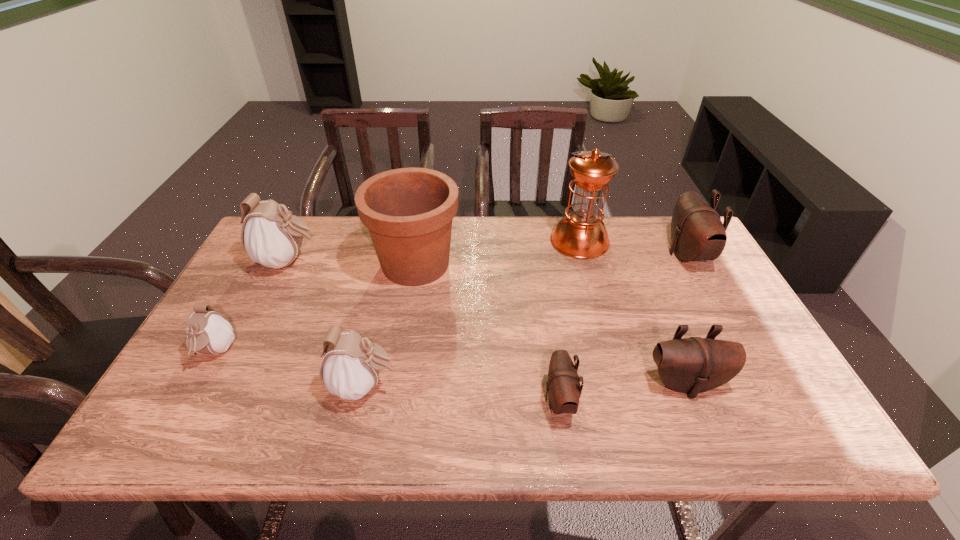
The height and width of the screenshot is (540, 960). Find the location of `vacant space at the far left corner of the desktop`. vacant space at the far left corner of the desktop is located at coordinates (300, 258).

You are a GUI agent. You are given a task and a screenshot of the screen. Output one action in this format:
    pyautogui.click(x=<x>, y=<y>)
    Task: Click on the free space between the second brown pouch from right to left and the fourth pouch from right to left
    
    Given the screenshot: What is the action you would take?
    pyautogui.click(x=525, y=384)

The image size is (960, 540). I want to click on free spot between the tallest object and the smallest white pouch, so click(397, 296).

Locate an element on the screen. Image resolution: width=960 pixels, height=540 pixels. vacant space in between the farthest brown pouch and the farthest white pouch is located at coordinates (488, 258).

Locate an element on the screen. The height and width of the screenshot is (540, 960). free space between the rightmost object and the smallest white pouch is located at coordinates (451, 303).

The width and height of the screenshot is (960, 540). I want to click on vacant region between the fourth pouch from left to right and the tallest object, so click(569, 320).

Locate an element on the screen. free space that is in between the biggest white pouch and the rightmost white pouch is located at coordinates (326, 323).

I want to click on unoccupied area between the farthest white pouch and the fifth pouch from left to right, so click(x=487, y=322).

You are a GUI agent. You are given a task and a screenshot of the screen. Output one action in this format:
    pyautogui.click(x=<x>, y=<y>)
    Task: Click on the free point between the rightmost pouch and the flowerpot
    
    Given the screenshot: What is the action you would take?
    pyautogui.click(x=551, y=259)

At what (x,y) coordinates should I click in order to perform the action: click on vacant area that lies between the smallest brown pouch and the second biggest white pouch. Please return your answer as a coordinate pair (x, y). Looking at the image, I should click on (462, 393).